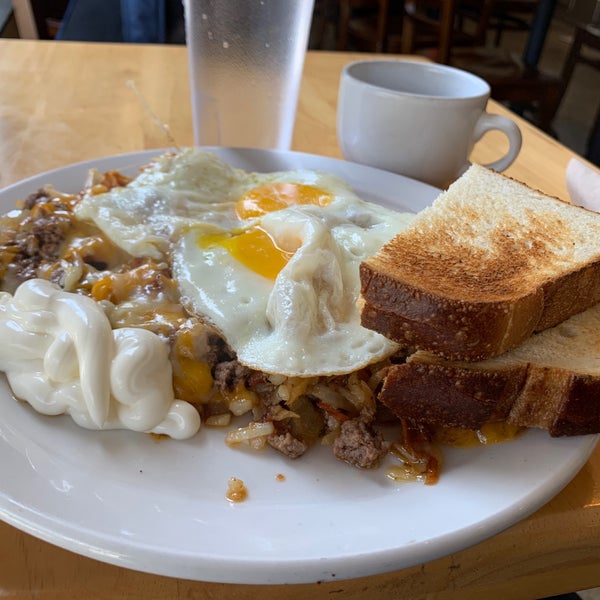
Find the location of `tea cup`. tea cup is located at coordinates (423, 137).